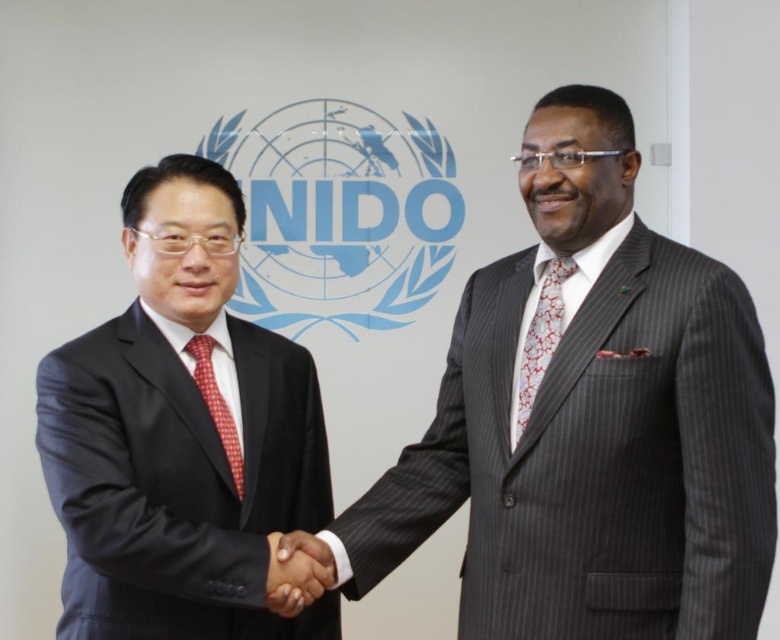
Between red floral silk tie at center and red checkered tie at center, which one appears on the left side from the viewer's perspective?

red checkered tie at center is more to the left.

Is red floral silk tie at center in front of red checkered tie at center?

Yes, red floral silk tie at center is in front of red checkered tie at center.

Is point (544, 314) farther from viewer compared to point (225, 456)?

No, it is in front of (225, 456).

Locate an element on the screen. The width and height of the screenshot is (780, 640). red floral silk tie at center is located at coordinates (541, 339).

Which is more to the right, gray pinstripe suit at center or red floral silk tie at center?

gray pinstripe suit at center is more to the right.

Does gray pinstripe suit at center have a smaller size compared to red floral silk tie at center?

No, gray pinstripe suit at center is not smaller than red floral silk tie at center.

Who is more distant from viewer, (552, 164) or (548, 356)?

Positioned behind is point (548, 356).

What are the coordinates of `gray pinstripe suit at center` in the screenshot? It's located at (591, 422).

Does matte black suit at left have a greater height compared to red floral silk tie at center?

Yes.

Who is positioned more to the right, matte black suit at left or red floral silk tie at center?

From the viewer's perspective, red floral silk tie at center appears more on the right side.

In order to click on matte black suit at left in this screenshot , I will do point(181,435).